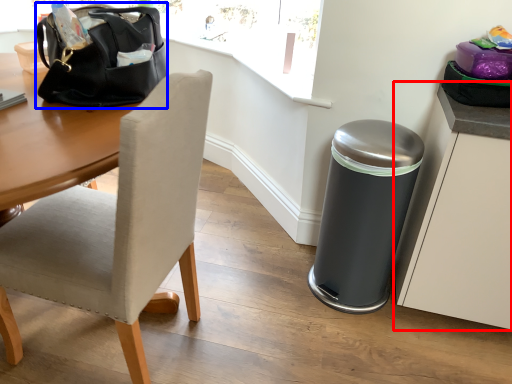
Question: Which point is closer to the camera, cabinetry (highlighted by a red box) or handbag (highlighted by a blue box)?

Choices:
 (A) cabinetry
 (B) handbag

Answer: (B)